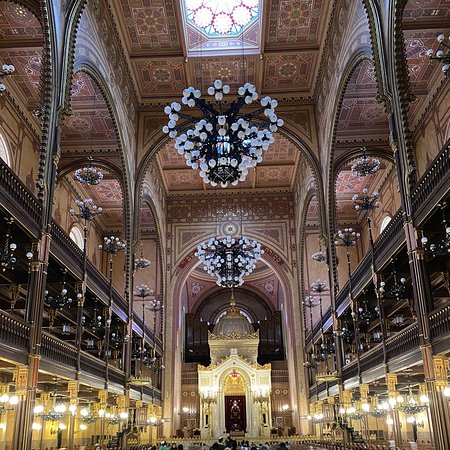
This screenshot has height=450, width=450. Find the location of `entrance`. entrance is located at coordinates (379, 434).